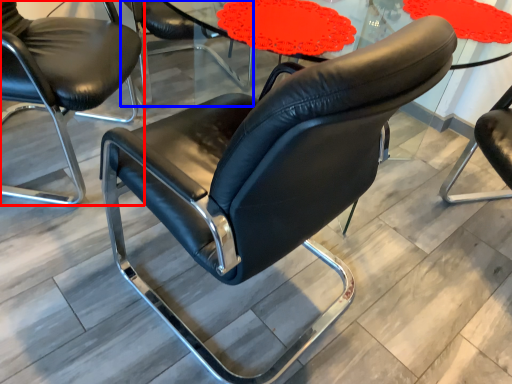
Question: Which object appears farthest to the camera in this image, chair (highlighted by a red box) or chair (highlighted by a blue box)?

Choices:
 (A) chair
 (B) chair

Answer: (B)